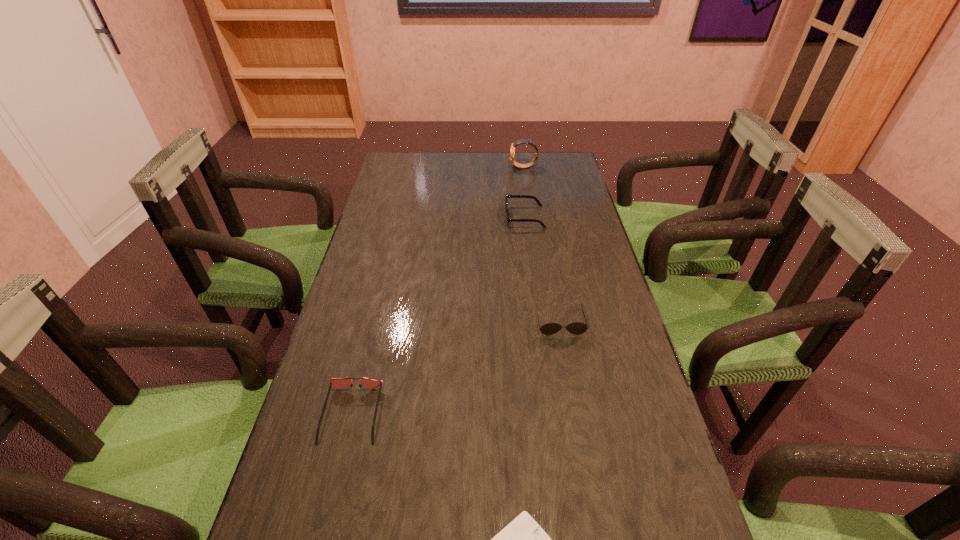
Identify the location of the farthest object. This screenshot has height=540, width=960. (522, 141).

Identify the location of the tallest object. (522, 141).

The image size is (960, 540). Find the location of `the second farthest object`. the second farthest object is located at coordinates (507, 196).

Identify the location of the third farthest object. (577, 328).

At what (x,y) coordinates should I click in order to perform the action: click on the leftmost object. Please return your answer as a coordinate pair (x, y). Image resolution: width=960 pixels, height=540 pixels. Looking at the image, I should click on (372, 383).

I want to click on the leftmost sunglasses, so tap(372, 383).

Locate an element on the screen. The width and height of the screenshot is (960, 540). free location located on the face of the farthest object is located at coordinates (460, 167).

This screenshot has width=960, height=540. Find the location of `blank area located 0.180m on the face of the farthest object`. blank area located 0.180m on the face of the farthest object is located at coordinates (466, 167).

Where is `vacant region located on the face of the farthest object`? The height and width of the screenshot is (540, 960). vacant region located on the face of the farthest object is located at coordinates (488, 167).

Where is `free space located 0.220m on the front-facing side of the farthest sunglasses`? free space located 0.220m on the front-facing side of the farthest sunglasses is located at coordinates (442, 217).